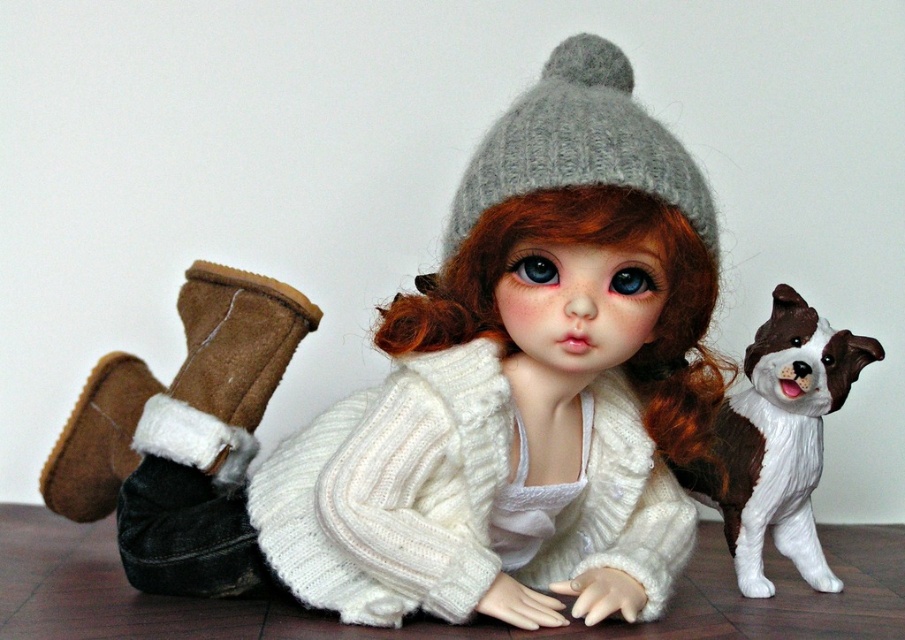
You are a fashion designer examining the doll and want to ensure the gray knitted hat at center and the brown suede boot at lower left are visible in the final photo. Based on their positions, which item is higher up on the doll?

The gray knitted hat at center is located above the brown suede boot at lower left, so the gray knitted hat at center is higher up on the doll.

You are a toy organizer who needs to place the white knitted sweater at center and the brown and white plastic dog at right into a vertical storage shelf. The shelf has two slots with the lower slot being 10 cm tall. Which object should be placed in the lower slot to ensure both fit without exceeding the height limit?

The brown and white plastic dog at right should be placed in the lower slot since the white knitted sweater at center is taller. The lower slot is only 10 cm tall, so the shorter brown and white plastic dog at right will fit better there.

You are a toy organizer who needs to place the white knitted sweater at center and the brown and white plastic dog at right into a display case. The display case has a width of 25 centimeters. Can both items fit side by side without overlapping?

The white knitted sweater at center is 23.04 centimeters away from the brown and white plastic dog at right. Since the distance between them is less than the display case width of 25 centimeters, both items can fit side by side without overlapping.